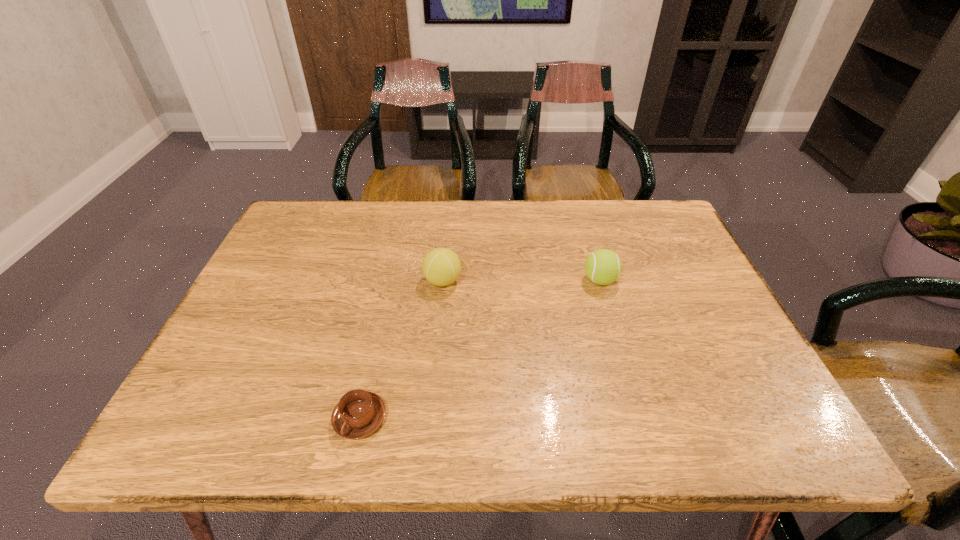
What are the coordinates of `unoccupied position between the left tennis ball and the rightmost object` in the screenshot? It's located at (521, 281).

Locate an element on the screen. This screenshot has width=960, height=540. vacant area between the second object from left to right and the nearest object is located at coordinates (401, 350).

At what (x,y) coordinates should I click in order to perform the action: click on object that is the second closest one to the left tennis ball. Please return your answer as a coordinate pair (x, y). This screenshot has width=960, height=540. Looking at the image, I should click on (603, 266).

Point out which object is positioned as the second nearest to the rightmost object. Please provide its 2D coordinates. Your answer should be formatted as a tuple, i.e. [(x, y)], where the tuple contains the x and y coordinates of a point satisfying the conditions above.

[(359, 413)]